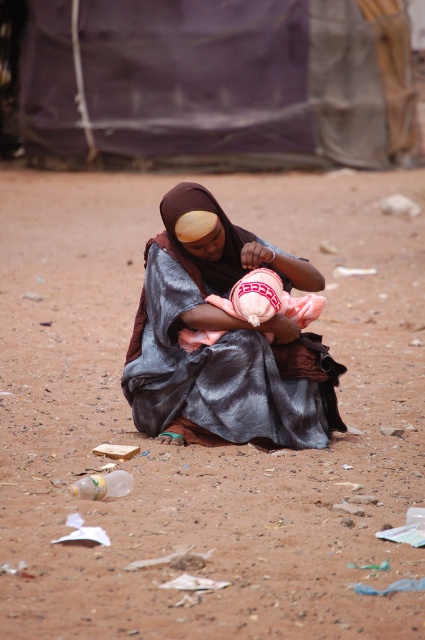
Question: Which object is farther from the camera taking this photo?

Choices:
 (A) silky brown dress at center
 (B) brown sandy dirt at center

Answer: (A)

Question: Does brown sandy dirt at center appear on the left side of silky brown dress at center?

Choices:
 (A) no
 (B) yes

Answer: (B)

Question: Which point appears farthest from the camera in this image?

Choices:
 (A) (101, 333)
 (B) (212, 220)

Answer: (A)

Question: Can you confirm if brown sandy dirt at center is positioned below silky brown dress at center?

Choices:
 (A) yes
 (B) no

Answer: (B)

Question: Which point is closer to the camera taking this photo?

Choices:
 (A) (90, 176)
 (B) (280, 252)
 (C) (260, 268)

Answer: (C)

Question: Is brown sandy dirt at center bigger than pink knitted hat at center?

Choices:
 (A) no
 (B) yes

Answer: (B)